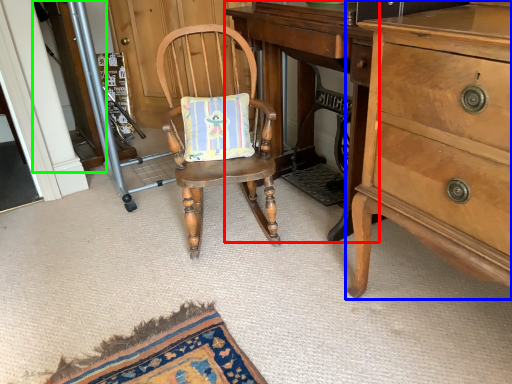
Question: Considering the real-world distances, which object is closest to changing table (highlighted by a red box)? cabinetry (highlighted by a blue box) or screen door (highlighted by a green box).

Choices:
 (A) cabinetry
 (B) screen door

Answer: (A)